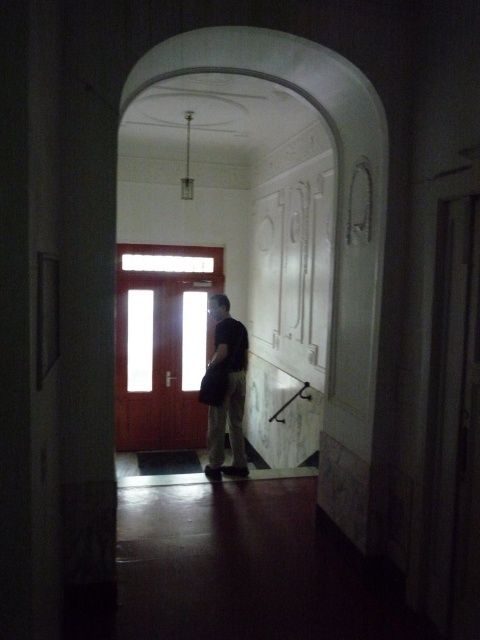
Who is shorter, wooden door at center or dark gray fabric bag at center?

dark gray fabric bag at center

Is wooden door at center thinner than dark gray fabric bag at center?

No, wooden door at center is not thinner than dark gray fabric bag at center.

Locate an element on the screen. wooden door at center is located at coordinates (159, 360).

The image size is (480, 640). Find the location of `wooden door at center`. wooden door at center is located at coordinates (159, 360).